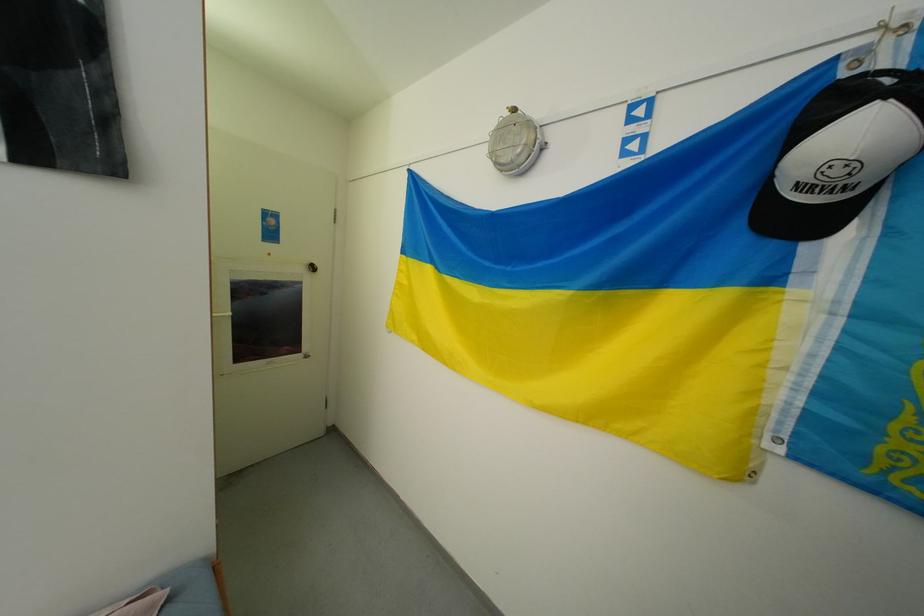
This screenshot has height=616, width=924. Find the location of `black baseball cap`. black baseball cap is located at coordinates (841, 154).